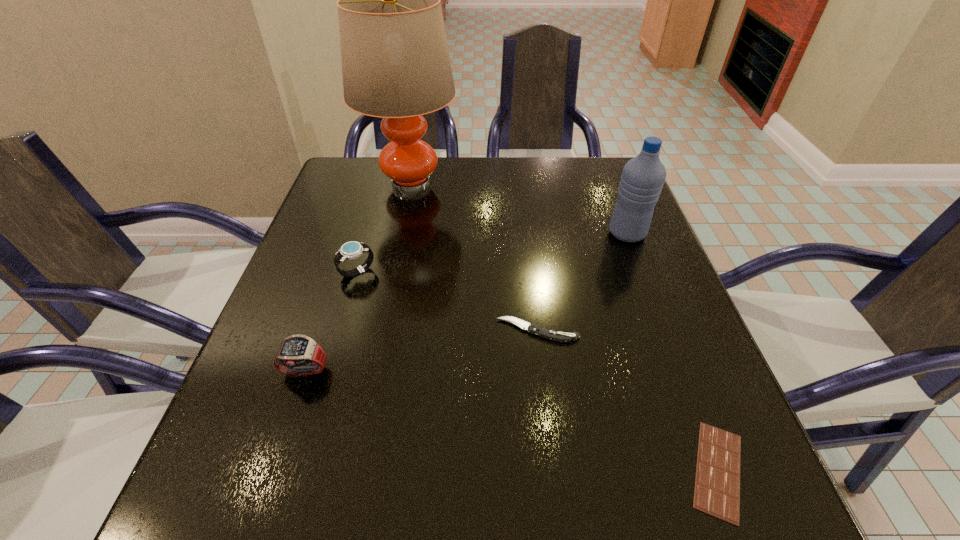
Where is `vacant space that's between the tallest object and the nearest object`? The image size is (960, 540). vacant space that's between the tallest object and the nearest object is located at coordinates (564, 327).

You are a GUI agent. You are given a task and a screenshot of the screen. Output one action in this format:
    pyautogui.click(x=<x>, y=<y>)
    Task: Click on the vacant space that's between the fourth object from left to right and the shortest object
    Image resolution: width=960 pixels, height=540 pixels.
    Given the screenshot: What is the action you would take?
    pyautogui.click(x=628, y=400)

This screenshot has height=540, width=960. In order to click on free spot between the fifth shortest object and the third nearest object in this screenshot , I will do `click(582, 282)`.

Locate an element on the screen. free space between the nearest object and the fourth object from left to right is located at coordinates (628, 400).

This screenshot has height=540, width=960. I want to click on vacant area that lies between the second farthest object and the shortest object, so click(672, 352).

Image resolution: width=960 pixels, height=540 pixels. I want to click on free area in between the lamp and the nearer watch, so click(x=358, y=278).

Where is `free space between the second tallest object and the nearer watch`? This screenshot has width=960, height=540. free space between the second tallest object and the nearer watch is located at coordinates (466, 302).

Locate an element on the screen. vacant area between the chocolate bar and the farther watch is located at coordinates (538, 371).

Locate an element on the screen. Image resolution: width=960 pixels, height=540 pixels. free spot between the fourth farthest object and the second nearest object is located at coordinates (420, 351).

Choose which object is the third nearest neighbor to the water bottle. Please provide its 2D coordinates. Your answer should be formatted as a tuple, i.e. [(x, y)], where the tuple contains the x and y coordinates of a point satisfying the conditions above.

[(717, 481)]